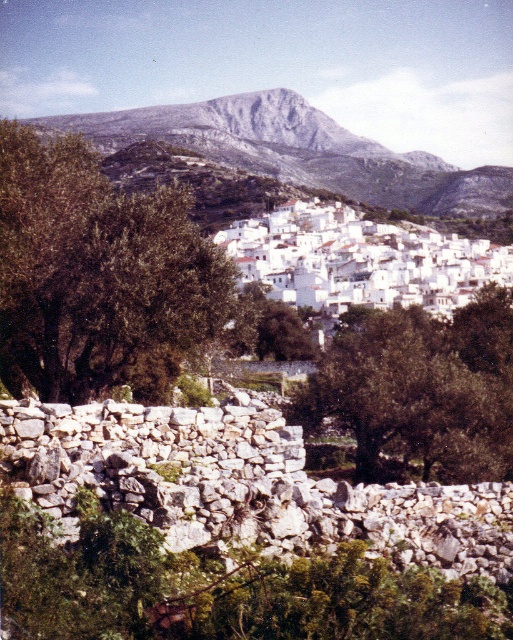
Between green leafy tree at center and white stone houses at center, which one is positioned lower?

green leafy tree at center is lower down.

Is green leafy tree at center to the left of white stone houses at center from the viewer's perspective?

In fact, green leafy tree at center is to the right of white stone houses at center.

At what (x,y) coordinates should I click in order to perform the action: click on green leafy tree at center. Please return your answer as a coordinate pair (x, y). Looking at the image, I should click on (421, 390).

Find the location of `green leafy tree at center`. green leafy tree at center is located at coordinates pos(421,390).

Who is positioned more to the left, green leafy tree at left or green leafy tree at center?

Positioned to the left is green leafy tree at left.

Is the position of green leafy tree at left more distant than that of green leafy tree at center?

That is True.

Does point (40, 291) lie behind point (363, 364)?

No.

The image size is (513, 640). I want to click on green leafy tree at left, so click(98, 276).

Describe the element at coordinates (98, 276) in the screenshot. This screenshot has height=640, width=513. I see `green leafy tree at left` at that location.

Which is above, green leafy tree at left or rugged stone mountain at upper center?

rugged stone mountain at upper center

The width and height of the screenshot is (513, 640). I want to click on green leafy tree at left, so click(98, 276).